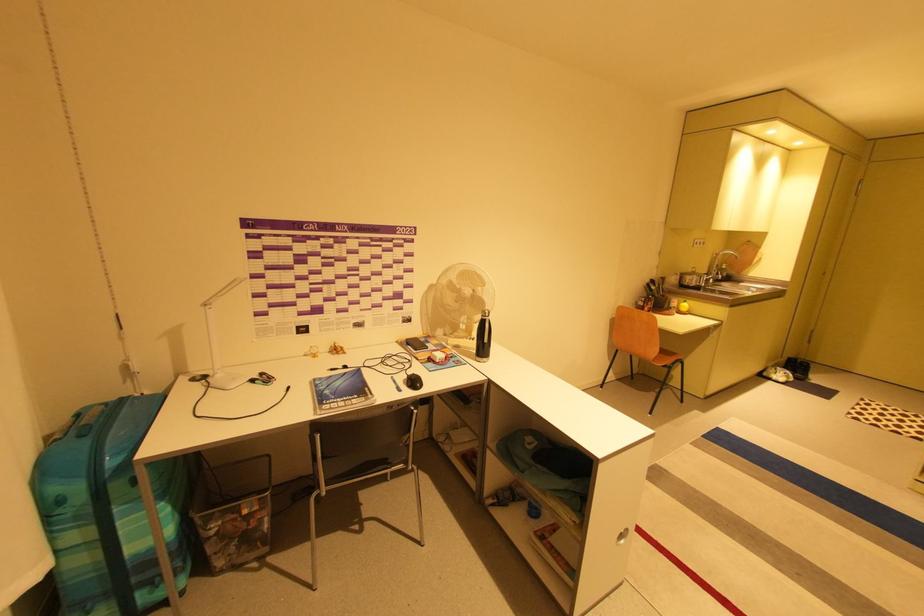
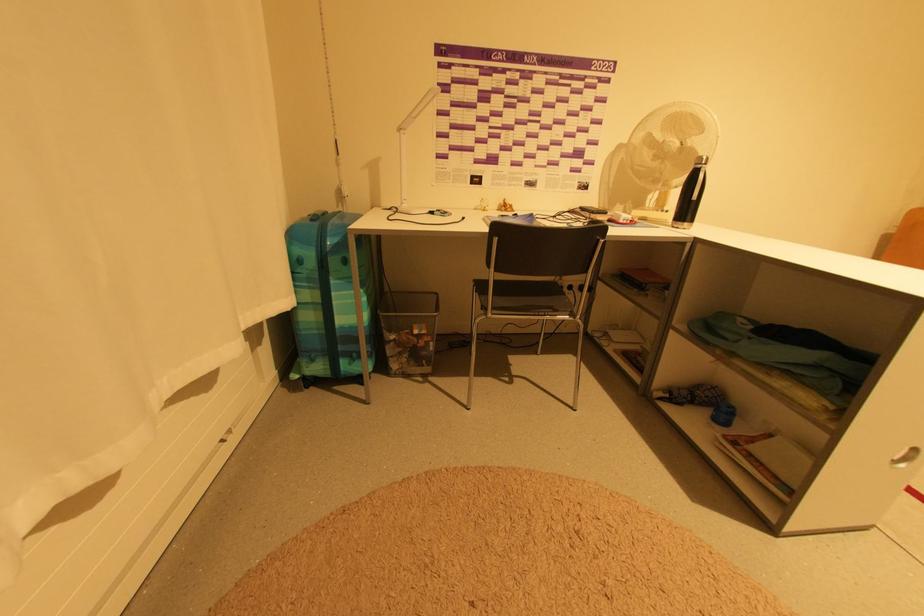
In a continuous first-person perspective shot, in which direction is the camera moving?

The cameraman moved toward left, forward.